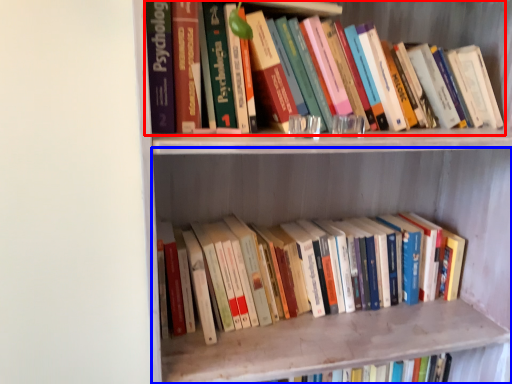
Question: Among these objects, which one is nearest to the camera, book (highlighted by a red box) or shelf (highlighted by a blue box)?

Choices:
 (A) book
 (B) shelf

Answer: (B)